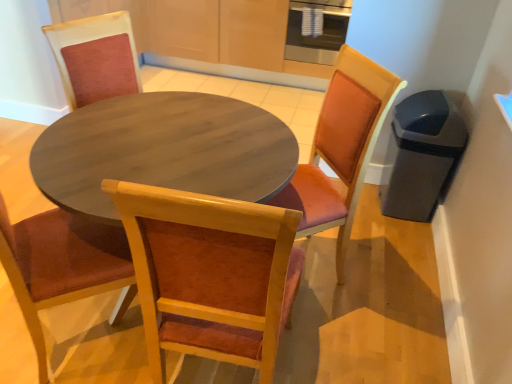
In order to click on unoccupied region to the right of wooden chair at center, acting as the first chair starting from the front in this screenshot , I will do `click(334, 340)`.